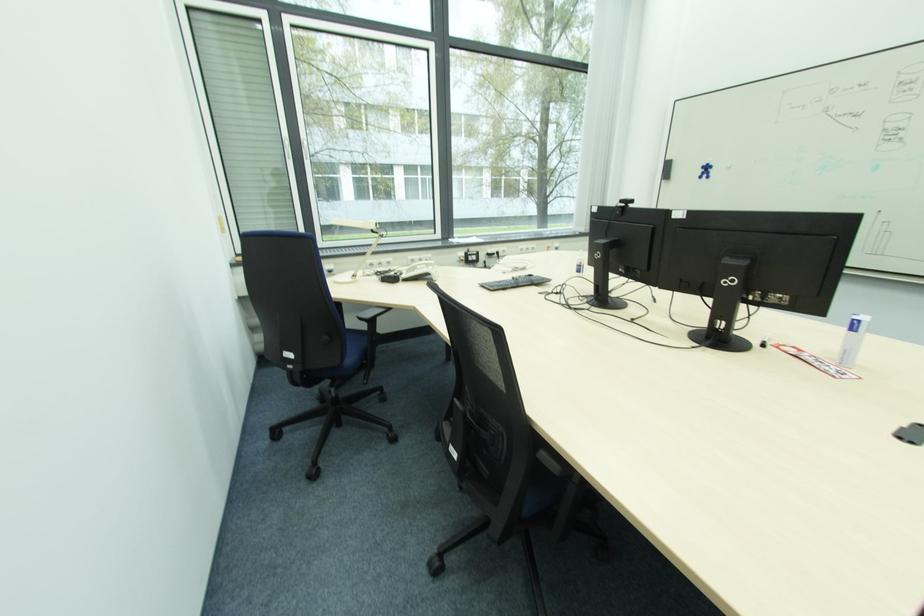
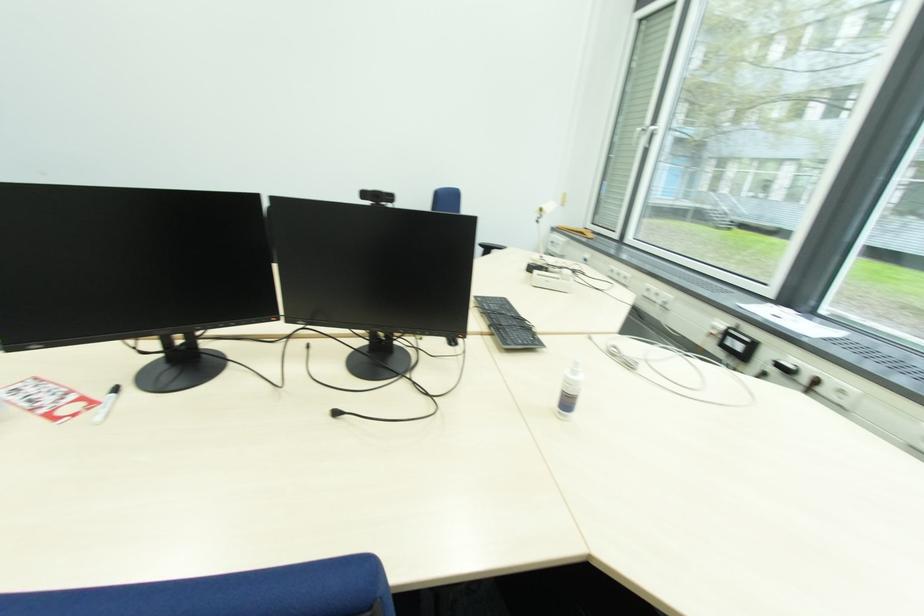
In the second image, find the point that corresponds to (x=472, y=256) in the first image.

(734, 333)